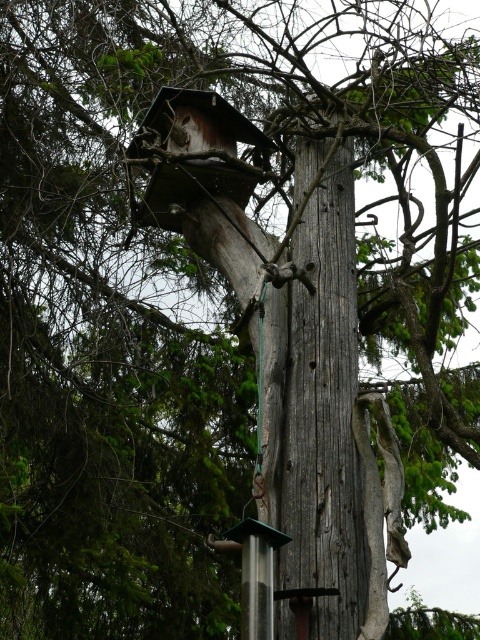
Question: Which of the following is the closest to the observer?

Choices:
 (A) (363, 490)
 (B) (179, 193)

Answer: (A)

Question: Among these objects, which one is nearest to the camera?

Choices:
 (A) weathered wood tree trunk at center
 (B) wooden birdhouse at upper center

Answer: (A)

Question: Among these points, which one is nearest to the camera?

Choices:
 (A) (157, 136)
 (B) (369, 486)

Answer: (B)

Question: From the image, what is the correct spatial relationship of weathered wood tree trunk at center in relation to wooden birdhouse at upper center?

Choices:
 (A) below
 (B) above

Answer: (A)

Question: Can you confirm if weathered wood tree trunk at center is bigger than wooden birdhouse at upper center?

Choices:
 (A) yes
 (B) no

Answer: (A)

Question: Can you confirm if weathered wood tree trunk at center is positioned above wooden birdhouse at upper center?

Choices:
 (A) no
 (B) yes

Answer: (A)